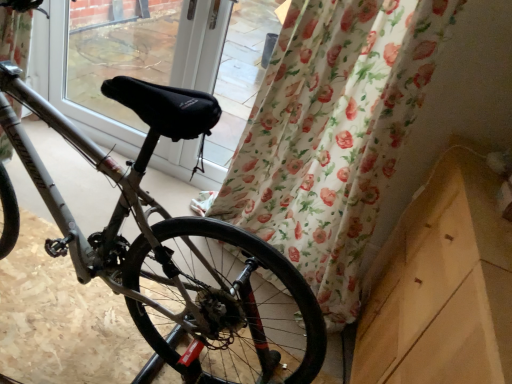
Question: Visually, is silver metallic bicycle wheel at lower left positioned to the left or to the right of floral fabric curtain at lower right?

Choices:
 (A) left
 (B) right

Answer: (A)

Question: Relative to floral fabric curtain at lower right, is silver metallic bicycle wheel at lower left in front or behind?

Choices:
 (A) front
 (B) behind

Answer: (B)

Question: Estimate the real-world distances between objects in this image. Which object is closer to the floral fabric curtain at lower right?

Choices:
 (A) black fabric at center
 (B) silver metallic bicycle wheel at lower left
 (C) silver metallic bicycle at center

Answer: (B)

Question: Which is farther from the black fabric at center?

Choices:
 (A) silver metallic bicycle wheel at lower left
 (B) floral fabric curtain at lower right
 (C) silver metallic bicycle at center

Answer: (A)